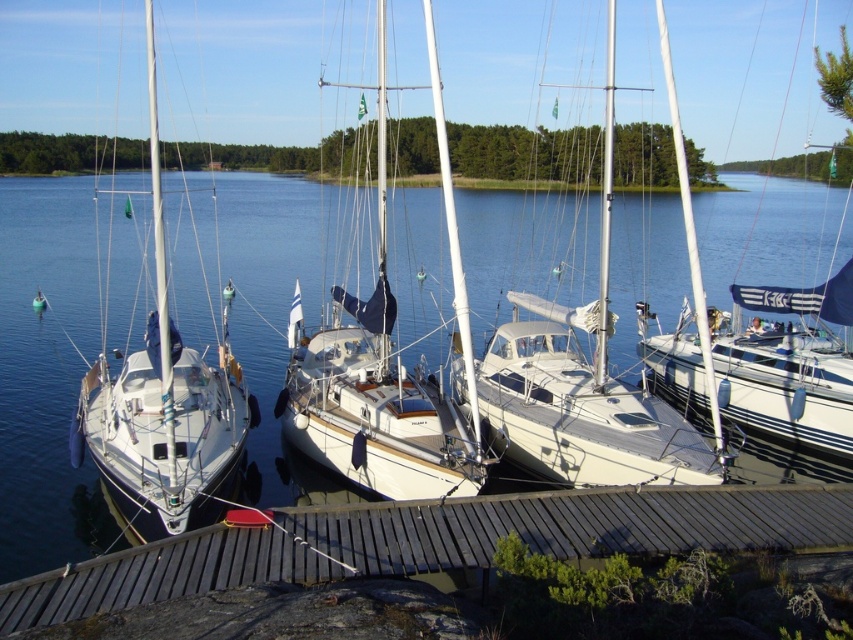
You are standing on the wooden dock at lower center and want to board the white glossy sailboat at center. Which direction should you move to reach the boat?

The wooden dock at lower center is positioned on the left side of white glossy sailboat at center, so you should move to the right to reach the boat.

Consider the image. You are a sailor standing on the wooden pier and want to check the water level under your white glossy sailboat at center. According to the scene, where is the clear blue water at center located in relation to your sailboat?

The clear blue water at center is positioned under the white glossy sailboat at center, so the water is directly beneath the boat.

You are a boat operator who needs to secure a new sailboat to the wooden dock at lower center. The sailboat you have is 12 meters long. Can you safely dock it at the white glossy sailboat at center without damaging the existing boats nearby?

The wooden dock at lower center is 13.15 meters away from the white glossy sailboat at center. Since the new sailboat is 12 meters long, there is enough space between them to dock safely without damaging the existing boats.